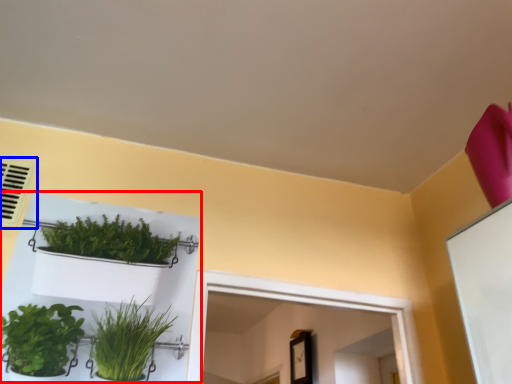
Question: Which object appears farthest to the camera in this image, shelf (highlighted by a red box) or air conditioning (highlighted by a blue box)?

Choices:
 (A) shelf
 (B) air conditioning

Answer: (B)